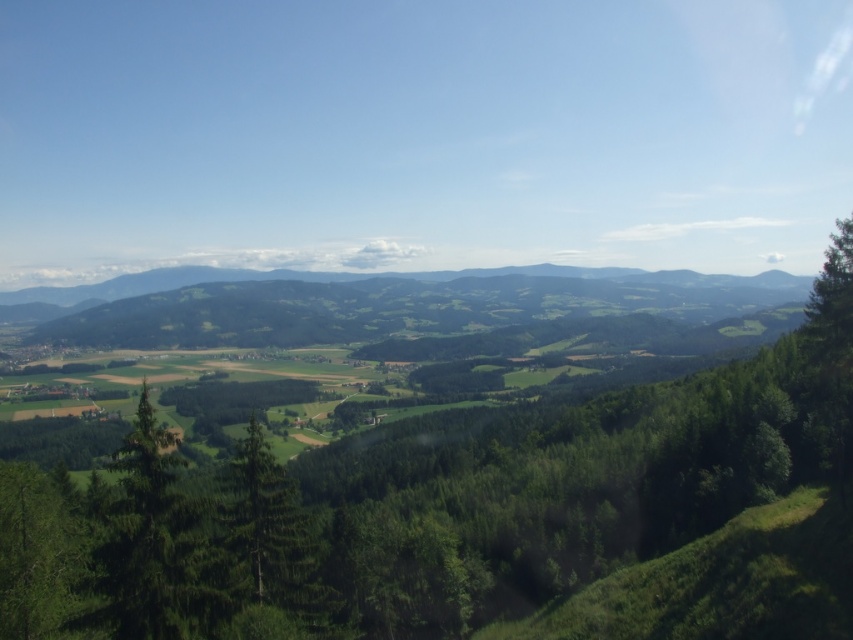
How much distance is there between green leafy tree at center and green matte tree at center?

A distance of 148.10 meters exists between green leafy tree at center and green matte tree at center.

Which is below, green leafy tree at center or green matte tree at center?

Positioned lower is green matte tree at center.

Between point (434, 449) and point (320, 588), which one is positioned behind?

The point (434, 449) is behind.

The image size is (853, 640). What are the coordinates of `green leafy tree at center` in the screenshot? It's located at (467, 493).